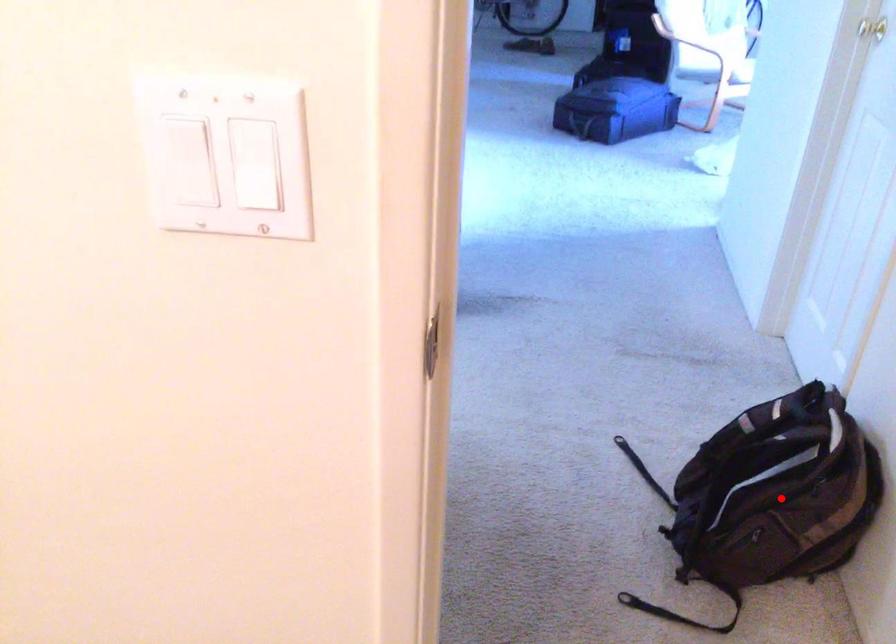
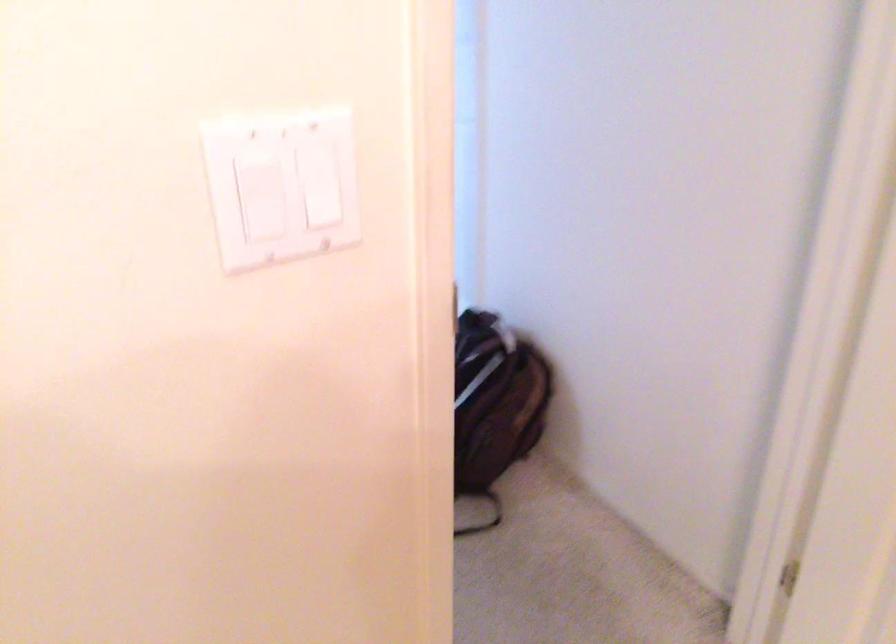
Where in the second image is the point corresponding to the highlighted location from the first image?

(494, 404)